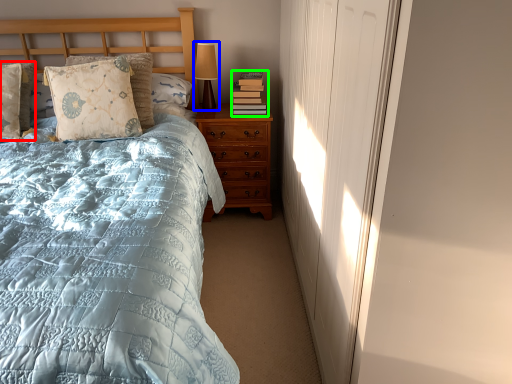
Question: Which object is positioned closest to pillow (highlighted by a red box)? Select from table lamp (highlighted by a blue box) and book (highlighted by a green box).

Choices:
 (A) table lamp
 (B) book

Answer: (A)